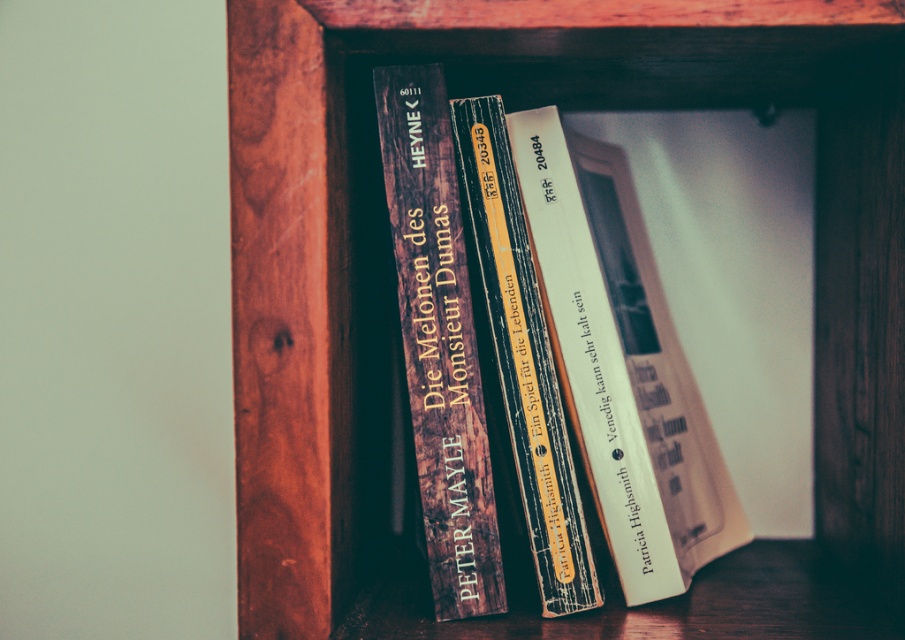
Question: Considering the relative positions of wooden bookshelf at center and wooden book at center in the image provided, where is wooden bookshelf at center located with respect to wooden book at center?

Choices:
 (A) right
 (B) left

Answer: (A)

Question: Which of these objects is positioned closest to the white paper book at center?

Choices:
 (A) wooden bookshelf at center
 (B) wooden spines at center
 (C) wooden book at center

Answer: (B)

Question: Which point is farther from the camera taking this photo?

Choices:
 (A) coord(481,205)
 (B) coord(579,397)

Answer: (B)

Question: Which object is the farthest from the wooden book at center?

Choices:
 (A) white paper book at center
 (B) wooden bookshelf at center

Answer: (B)

Question: Does white paper book at center appear over wooden spines at center?

Choices:
 (A) no
 (B) yes

Answer: (B)

Question: Is wooden bookshelf at center thinner than wooden book at center?

Choices:
 (A) no
 (B) yes

Answer: (A)